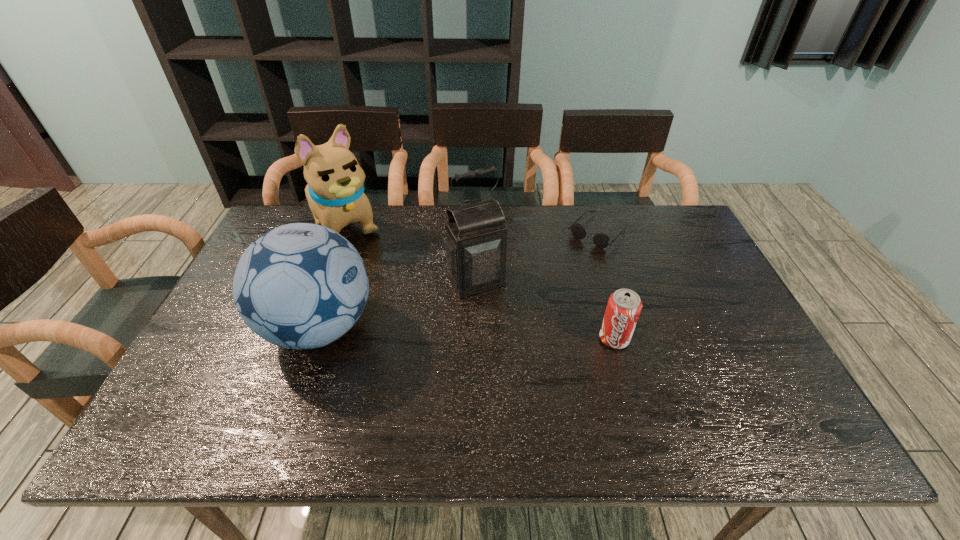
Where is `free area in between the shortest object and the fourth tallest object`? The width and height of the screenshot is (960, 540). free area in between the shortest object and the fourth tallest object is located at coordinates (606, 285).

I want to click on unoccupied position between the soccer ball and the soda can, so coord(467,333).

At what (x,y) coordinates should I click in order to perform the action: click on vacant space in between the soccer ball and the soda can. Please return your answer as a coordinate pair (x, y). The width and height of the screenshot is (960, 540). Looking at the image, I should click on (467, 333).

Locate which object ranks fourth in proximity to the soda can. Please provide its 2D coordinates. Your answer should be formatted as a tuple, i.e. [(x, y)], where the tuple contains the x and y coordinates of a point satisfying the conditions above.

[(335, 192)]

Identify which object is located as the nearest to the puppy. Please provide its 2D coordinates. Your answer should be formatted as a tuple, i.e. [(x, y)], where the tuple contains the x and y coordinates of a point satisfying the conditions above.

[(300, 286)]

At what (x,y) coordinates should I click in order to perform the action: click on free space that satisfies the following two spatial constraints: 1. on the front side of the soccer ball; 2. on the side with brand of the puppy. Please return your answer as a coordinate pair (x, y). The image size is (960, 540). Looking at the image, I should click on (305, 328).

The width and height of the screenshot is (960, 540). I want to click on free location that satisfies the following two spatial constraints: 1. on the back side of the second shortest object; 2. on the left side of the sunglasses, so click(584, 232).

Where is `free space that satisfies the following two spatial constraints: 1. on the front side of the third object from left to right; 2. on the right side of the puppy`? Image resolution: width=960 pixels, height=540 pixels. free space that satisfies the following two spatial constraints: 1. on the front side of the third object from left to right; 2. on the right side of the puppy is located at coordinates click(x=324, y=280).